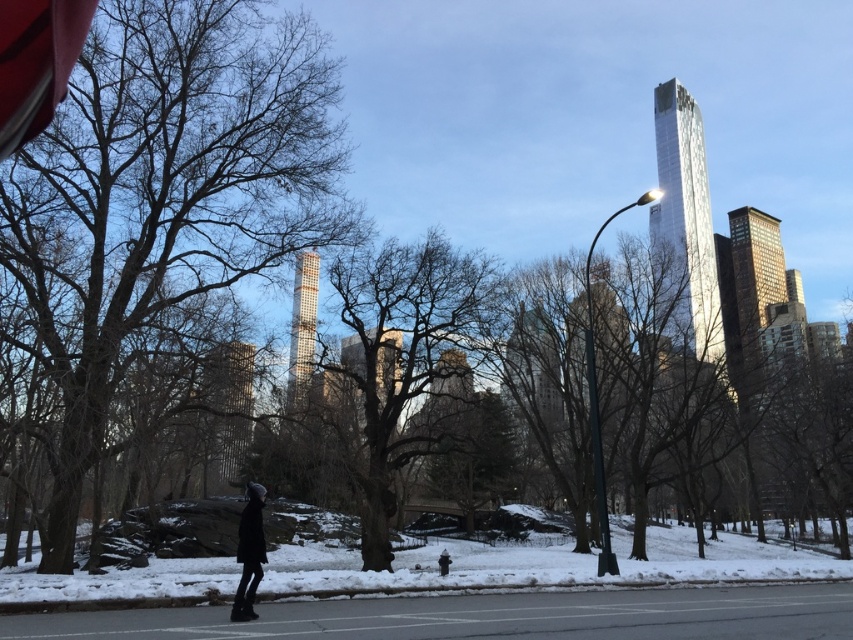
You are a photographer planning to capture a winter landscape. You want to include both the smooth brown tree at left and the smooth brown tree at center in your shot. Which tree should you focus on to ensure it appears wider in the photo?

The smooth brown tree at left is wider than the smooth brown tree at center, so focusing on it will make it appear wider in the photo.